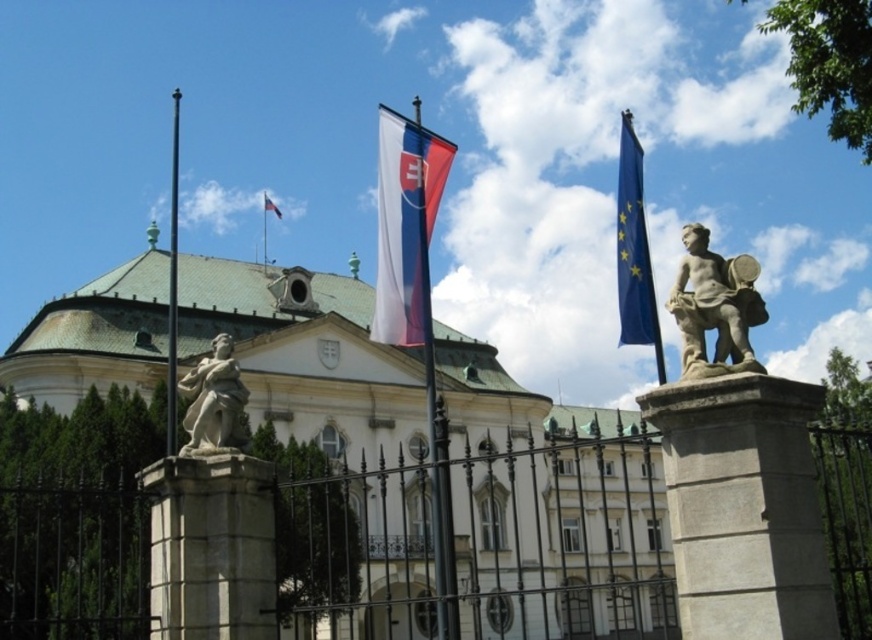
You are standing in front of the grand classical building and want to take a photo. You notice two points marked on your map at coordinates point (737, 364) and point (278, 212). Which point will appear larger in your camera view?

Point (737, 364) is closer to the camera than point (278, 212), so it will appear larger in the camera view.

You are standing in front of the building and need to determine which object is shorter between the stone statue at upper right and the red fabric flag at center. Can you tell me which one is shorter?

The stone statue at upper right is not as tall as the red fabric flag at center, so the stone statue at upper right is shorter.